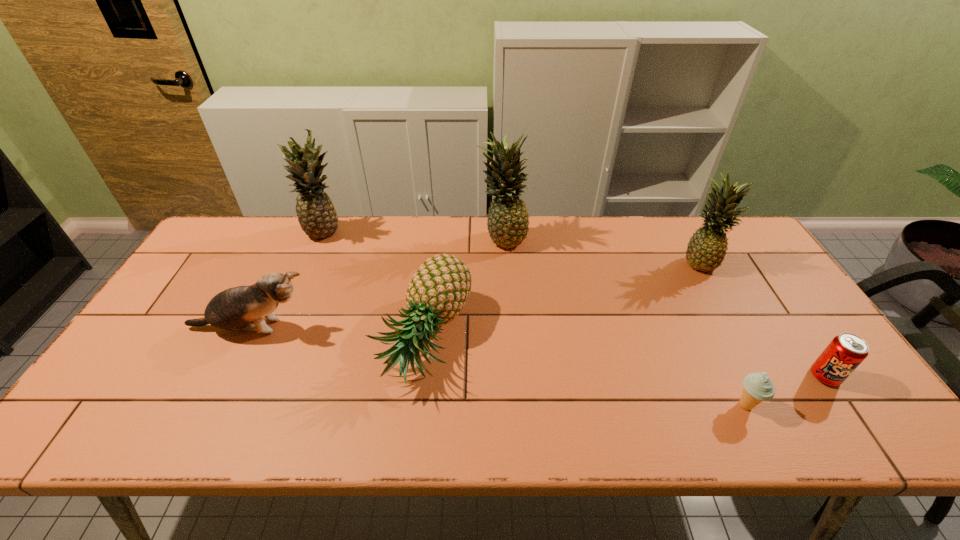
Where is `object that is at the far right corner`? This screenshot has width=960, height=540. object that is at the far right corner is located at coordinates (706, 250).

At what (x,y) coordinates should I click in order to perform the action: click on vacant space at the far edge. Please return your answer as a coordinate pair (x, y). The image size is (960, 540). Looking at the image, I should click on (305, 247).

Where is `free space at the near edge of the desktop`? The height and width of the screenshot is (540, 960). free space at the near edge of the desktop is located at coordinates (232, 413).

This screenshot has width=960, height=540. What are the coordinates of `free location at the far left corner of the desktop` in the screenshot? It's located at (252, 246).

In the image, there is a desktop. Identify the location of vacant space at the near right corner. This screenshot has width=960, height=540. (854, 432).

The height and width of the screenshot is (540, 960). In order to click on vacant region between the fourth object from left to right and the rightmost object in this screenshot , I will do `click(663, 307)`.

You are a GUI agent. You are given a task and a screenshot of the screen. Output one action in this format:
    pyautogui.click(x=<x>, y=<y>)
    Task: Click on the vacant area between the fifth shortest object and the third pineapple from right to left
    
    Given the screenshot: What is the action you would take?
    pyautogui.click(x=563, y=300)

This screenshot has width=960, height=540. I want to click on free area in between the leftmost pineapple and the third pineapple from right to left, so click(x=373, y=285).

I want to click on free space between the third tallest pineapple and the nearest pineapple, so click(563, 300).

This screenshot has height=540, width=960. In order to click on free space between the soda can and the second pineapple from right to left in this screenshot , I will do `click(663, 307)`.